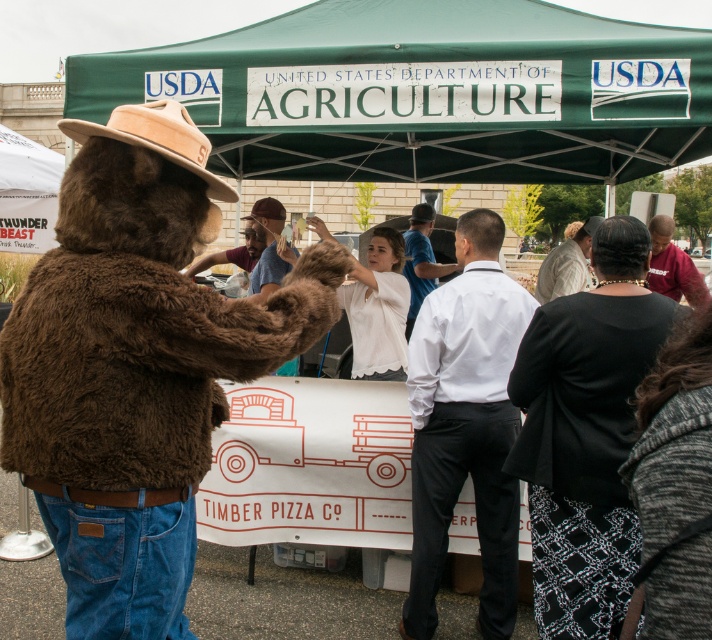
Who is positioned more to the right, white smooth shirt at center or brown fur hat at center?

Positioned to the right is white smooth shirt at center.

Does white smooth shirt at center have a lesser height compared to brown fur hat at center?

Incorrect, white smooth shirt at center's height does not fall short of brown fur hat at center's.

Which is in front, point (478, 628) or point (276, 278)?

Positioned in front is point (478, 628).

Locate an element on the screen. This screenshot has width=712, height=640. white smooth shirt at center is located at coordinates (465, 426).

Looking at this image, is fuzzy brown bear at left below black textured jacket at lower right?

Incorrect, fuzzy brown bear at left is not positioned below black textured jacket at lower right.

Who is positioned more to the right, fuzzy brown bear at left or black textured jacket at lower right?

black textured jacket at lower right

Who is more distant from viewer, (x=127, y=452) or (x=604, y=403)?

Positioned behind is point (x=604, y=403).

Identify the location of fuzzy brown bear at left. The height and width of the screenshot is (640, 712). (135, 365).

Between green fabric canopy at upper center and brown fur hat at center, which one has less height?

green fabric canopy at upper center is shorter.

This screenshot has width=712, height=640. Find the location of `green fabric canopy at upper center`. green fabric canopy at upper center is located at coordinates (429, 92).

Who is more distant from viewer, [342,163] or [267,196]?

Point [267,196]

You are a GUI agent. You are given a task and a screenshot of the screen. Output one action in this format:
    pyautogui.click(x=<x>, y=<y>)
    Task: Click on the green fabric canopy at upper center
    This screenshot has width=712, height=640.
    Given the screenshot: What is the action you would take?
    pyautogui.click(x=429, y=92)